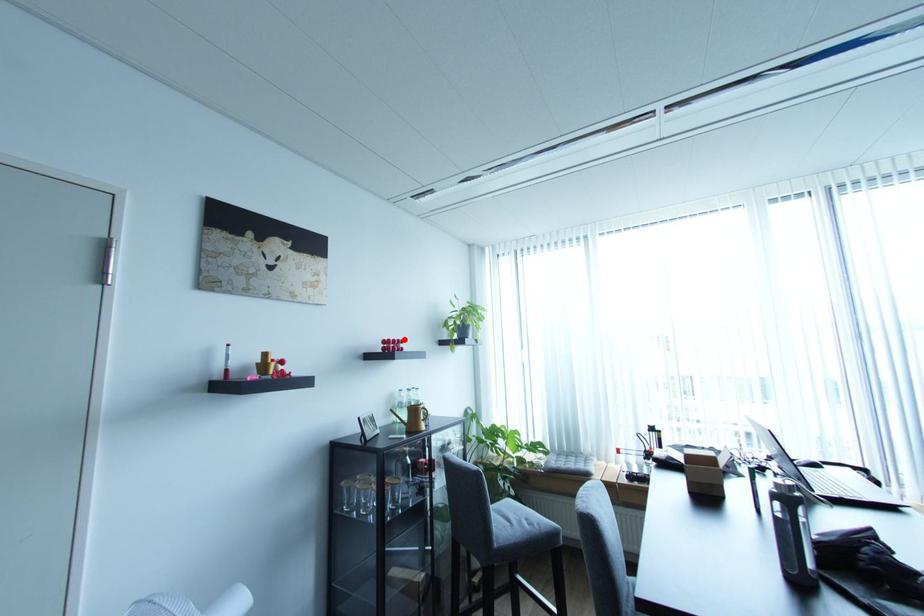
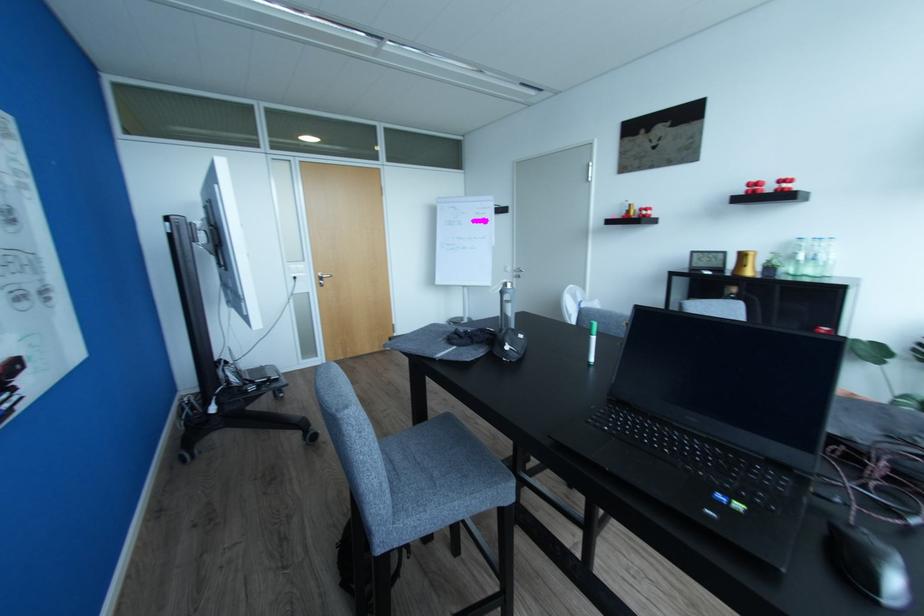
In the second image, find the point that corresponds to the highlighted location in the first image.

(791, 177)